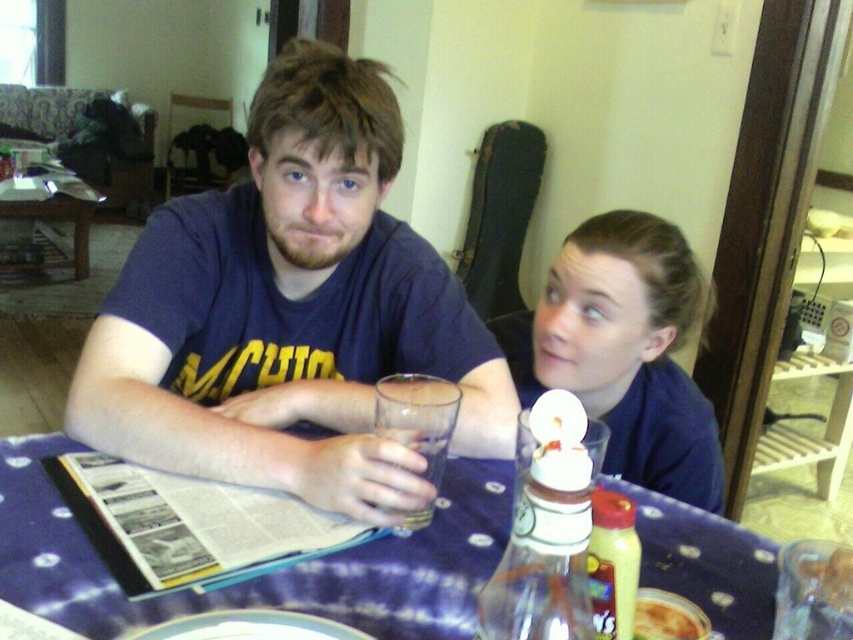
Is matte blue shirt at upper right taller than yellowish matte pizza at lower center?

Yes.

Does matte blue shirt at upper right appear over yellowish matte pizza at lower center?

Yes, matte blue shirt at upper right is above yellowish matte pizza at lower center.

Who is more distant from viewer, (646, 369) or (676, 637)?

The point (646, 369) is behind.

Where is `matte blue shirt at upper right`? matte blue shirt at upper right is located at coordinates (624, 349).

Is blue fabric table at center above yellowish matte pizza at lower center?

Indeed, blue fabric table at center is positioned over yellowish matte pizza at lower center.

Based on the photo, between blue fabric table at center and yellowish matte pizza at lower center, which one is positioned lower?

Positioned lower is yellowish matte pizza at lower center.

Does point (106, 632) come in front of point (670, 637)?

Yes.

Locate an element on the screen. The height and width of the screenshot is (640, 853). blue fabric table at center is located at coordinates (265, 576).

I want to click on blue fabric table at center, so click(265, 576).

Is point (7, 556) positioned behind point (426, 504)?

No, it is in front of (426, 504).

Identify the location of blue fabric table at center. The image size is (853, 640). (265, 576).